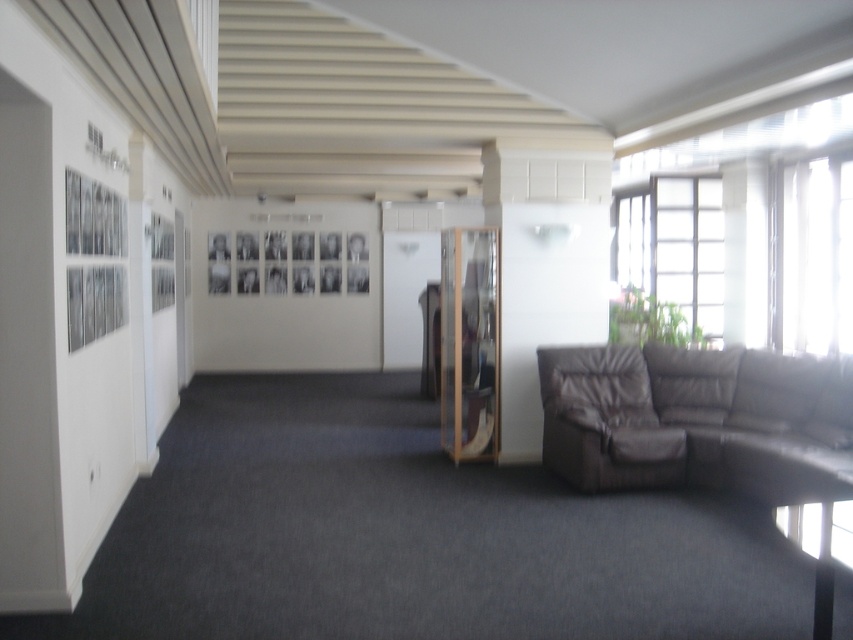
Question: Which point is closer to the camera?

Choices:
 (A) (665, 444)
 (B) (666, 396)

Answer: (A)

Question: Does brown leather couch at lower right lie behind brown leather armchair at lower right?

Choices:
 (A) yes
 (B) no

Answer: (B)

Question: Which point appears farthest from the camera in this image?

Choices:
 (A) (607, 381)
 (B) (724, 406)

Answer: (A)

Question: Considering the relative positions of brown leather couch at lower right and brown leather armchair at lower right in the image provided, where is brown leather couch at lower right located with respect to brown leather armchair at lower right?

Choices:
 (A) right
 (B) left

Answer: (A)

Question: Can you confirm if brown leather couch at lower right is smaller than brown leather armchair at lower right?

Choices:
 (A) yes
 (B) no

Answer: (B)